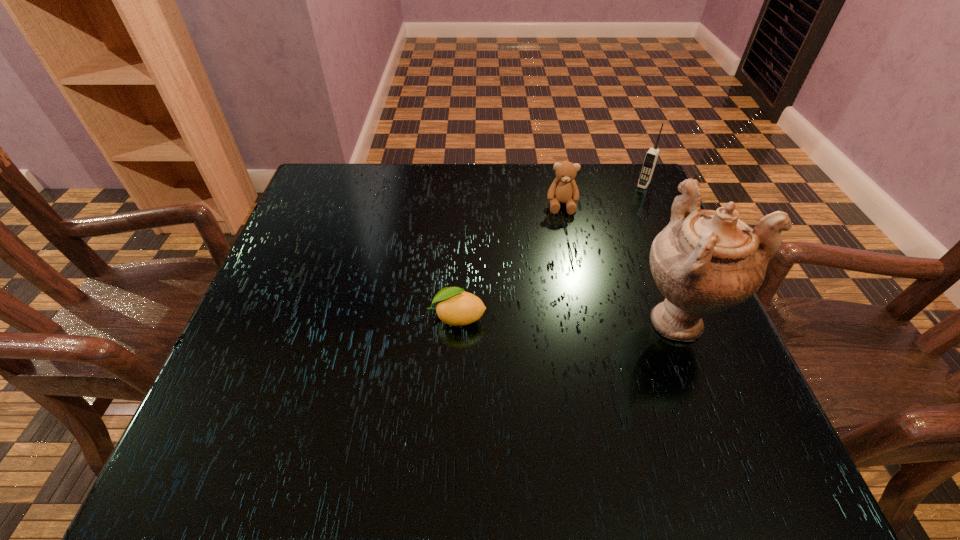
You are a GUI agent. You are given a task and a screenshot of the screen. Output one action in this format:
    pyautogui.click(x=<x>, y=<y>)
    Task: Click on the cellular telephone at the right edge
    Image resolution: width=960 pixels, height=540 pixels.
    Given the screenshot: What is the action you would take?
    pyautogui.click(x=651, y=157)

Image resolution: width=960 pixels, height=540 pixels. In order to click on object located in the far right corner section of the desktop in this screenshot , I will do `click(651, 157)`.

This screenshot has width=960, height=540. I want to click on free space at the far edge of the desktop, so click(x=383, y=186).

In the image, there is a desktop. Where is `free region at the near edge`? The image size is (960, 540). free region at the near edge is located at coordinates (509, 383).

Image resolution: width=960 pixels, height=540 pixels. Find the location of `free location at the left edge`. free location at the left edge is located at coordinates (330, 300).

Where is `free space at the far left corner of the desktop`? The width and height of the screenshot is (960, 540). free space at the far left corner of the desktop is located at coordinates (340, 217).

Locate an element on the screen. The height and width of the screenshot is (540, 960). vacant space in between the farthest object and the second farthest object is located at coordinates (603, 195).

Identify the location of free space between the second shortest object and the leftmost object. This screenshot has width=960, height=540. (510, 261).

Where is `free point between the second shortest object and the lemon`? free point between the second shortest object and the lemon is located at coordinates (510, 261).

At what (x,y) coordinates should I click in order to perform the action: click on empty space that is in between the teddy bear and the tallest object. Please return your answer as a coordinate pair (x, y). This screenshot has height=540, width=960. Looking at the image, I should click on (619, 262).